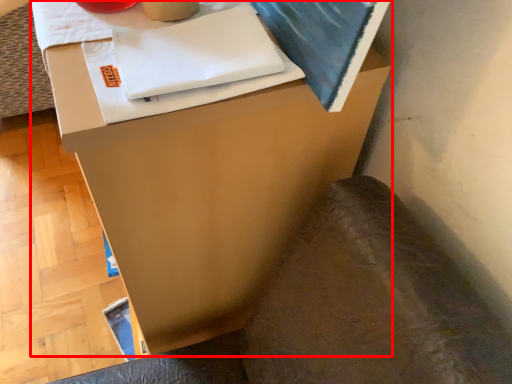
Question: From the image's perspective, considering the relative positions of furniture (annotated by the red box) and swivel chair in the image provided, where is furniture (annotated by the red box) located with respect to the staircase?

Choices:
 (A) above
 (B) below

Answer: (A)